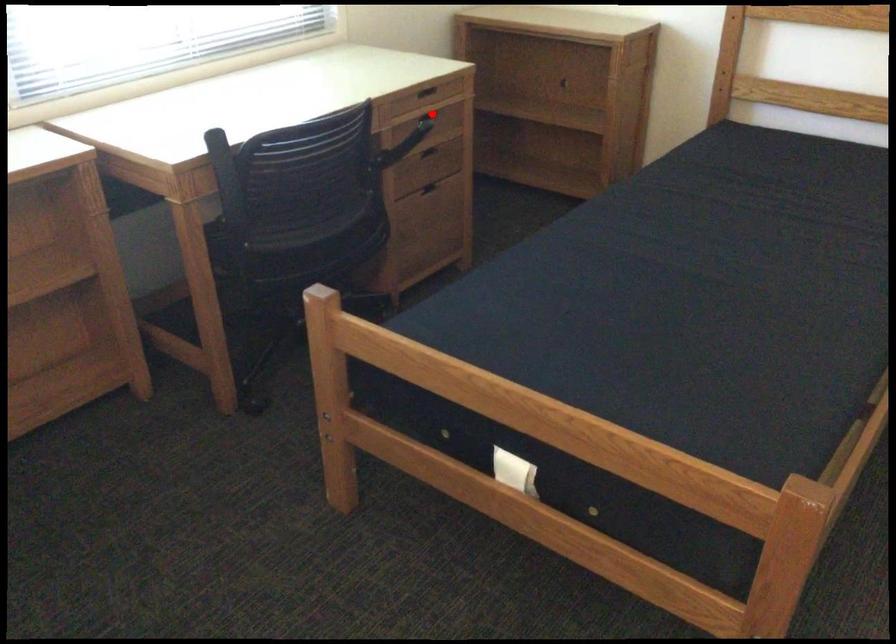
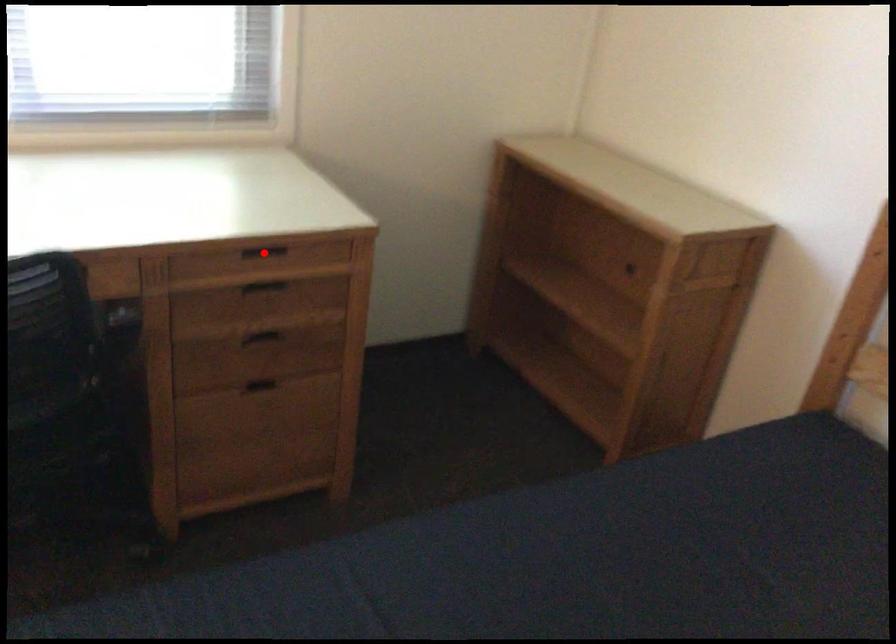
I am providing you with two images of the same scene from different viewpoints. A red point is marked on the first image and another point is marked on the second image. Do the highlighted points in image1 and image2 indicate the same real-world spot?

No